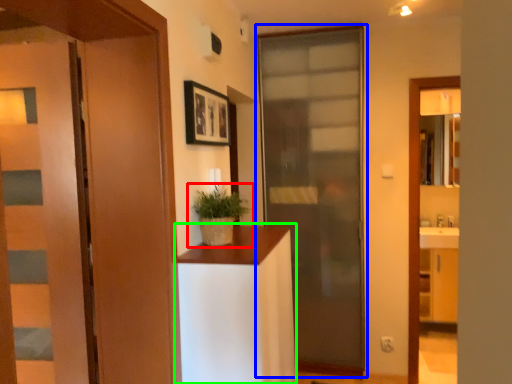
Question: Which object is the farthest from houseplant (highlighted by a red box)? Choose among these: door (highlighted by a blue box) or cabinetry (highlighted by a green box).

Choices:
 (A) door
 (B) cabinetry

Answer: (A)